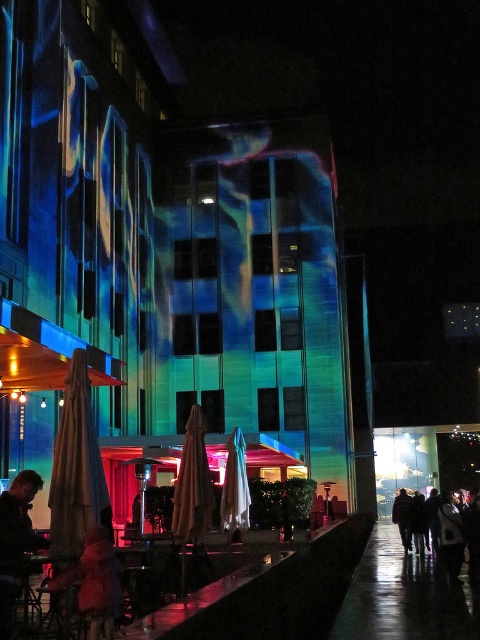
In the scene shown: You are a customer at the outdoor seating area and want to move from your current position near the beige fabric umbrella at left to the table under the white fabric umbrella at center. Which direction should you walk to reach the table?

You should walk towards the white fabric umbrella at center, which is further away from you than the beige fabric umbrella at left. Since the beige fabric umbrella at left is closer to the viewer, moving towards the center of the scene would lead you to the white fabric umbrella at center.

You are a photographer trying to capture both the fuzzy pink coat at lower left and the silhouette clothing at lower right in a single frame. Which object should you adjust your camera angle to focus on first to ensure both fit in the frame, considering their sizes?

The fuzzy pink coat at lower left is smaller in width than the silhouette clothing at lower right. To ensure both fit in the frame, focus on positioning the camera to include the larger silhouette clothing at lower right first, then adjust to include the smaller fuzzy pink coat at lower left.

You are a customer at the outdoor seating area and want to move from the fuzzy pink coat at lower left to the silhouette clothing at lower right. Which direction should you move to reach it?

To reach the silhouette clothing at lower right from the fuzzy pink coat at lower left, you should move to the right since the fuzzy pink coat at lower left is positioned to the left of the silhouette clothing at lower right.